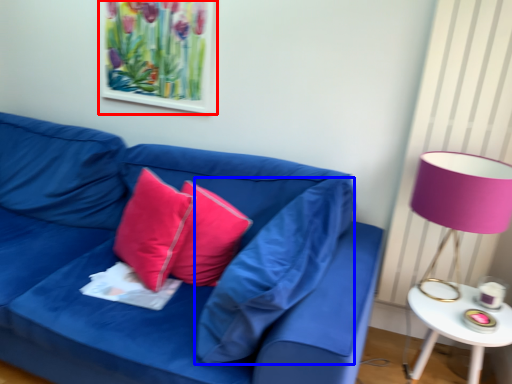
Question: Which of the following is the farthest to the observer, picture frame (highlighted by a red box) or pillow (highlighted by a blue box)?

Choices:
 (A) picture frame
 (B) pillow

Answer: (A)